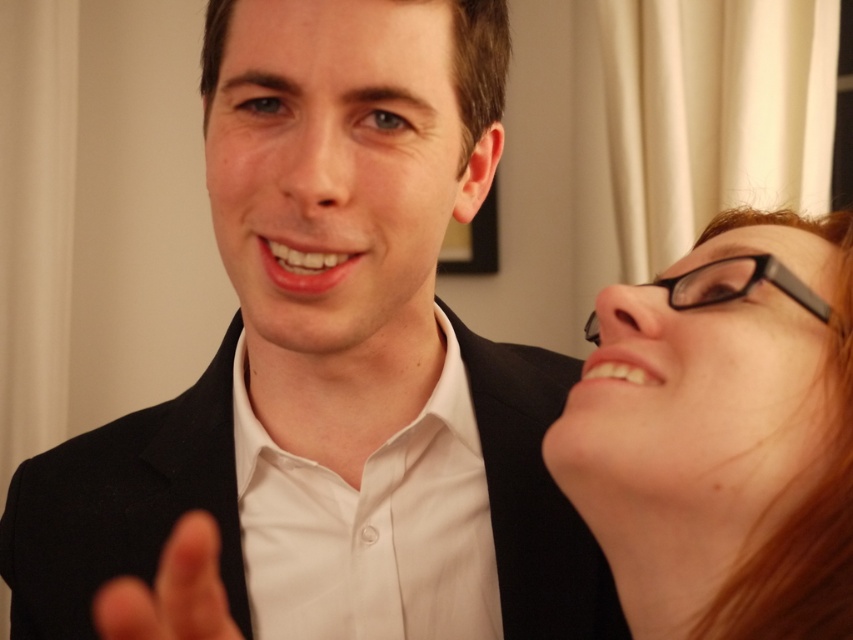
Question: Which object is positioned farthest from the matte black hand at center?

Choices:
 (A) matte black glasses at upper right
 (B) black matte suit at center
 (C) black plastic glasses at upper right

Answer: (C)

Question: Which point is closer to the camera?

Choices:
 (A) matte black hand at center
 (B) black plastic glasses at upper right

Answer: (A)

Question: Does black matte suit at center have a smaller size compared to black plastic glasses at upper right?

Choices:
 (A) no
 (B) yes

Answer: (A)

Question: Among these objects, which one is nearest to the camera?

Choices:
 (A) matte black glasses at upper right
 (B) black plastic glasses at upper right

Answer: (A)

Question: Does matte black glasses at upper right lie in front of matte black hand at center?

Choices:
 (A) yes
 (B) no

Answer: (B)

Question: Is black matte suit at center above black plastic glasses at upper right?

Choices:
 (A) yes
 (B) no

Answer: (B)